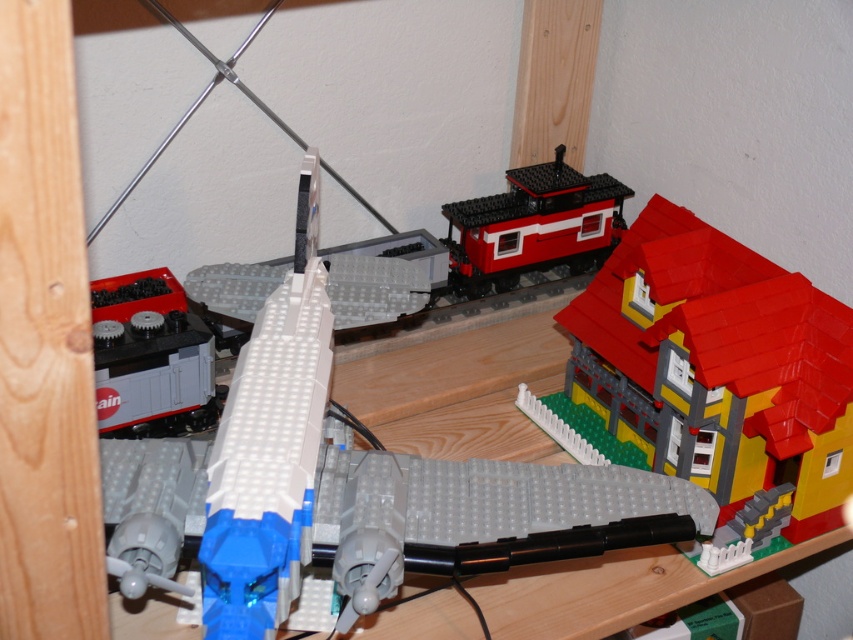
Question: Which point appears closest to the camera in this image?

Choices:
 (A) (813, 339)
 (B) (210, 275)

Answer: (A)

Question: Estimate the real-world distances between objects in this image. Which object is farther from the matte black train car at center?

Choices:
 (A) smooth plastic train car at center
 (B) yellow matte house at center right
 (C) white plastic train car at center

Answer: (B)

Question: Can you confirm if smooth plastic train car at center is positioned below matte black train car at center?

Choices:
 (A) yes
 (B) no

Answer: (B)

Question: Which object is the farthest from the matte black train car at center?

Choices:
 (A) white plastic train car at center
 (B) yellow matte house at center right
 (C) smooth plastic train car at center

Answer: (B)

Question: Is white plastic train car at center smaller than smooth plastic train car at center?

Choices:
 (A) no
 (B) yes

Answer: (A)

Question: Can you confirm if yellow matte house at center right is positioned below smooth plastic train car at center?

Choices:
 (A) no
 (B) yes

Answer: (B)